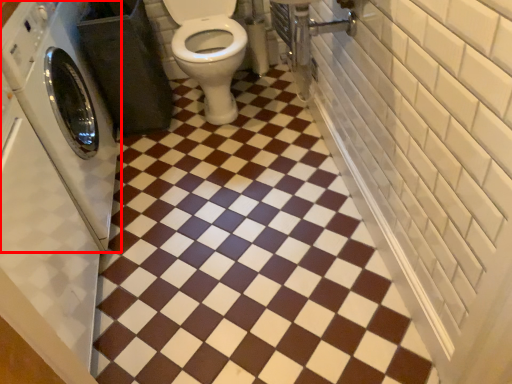
Question: From the image's perspective, where is washing machine (annotated by the red box) located relative to ceramic tile?

Choices:
 (A) below
 (B) above

Answer: (B)